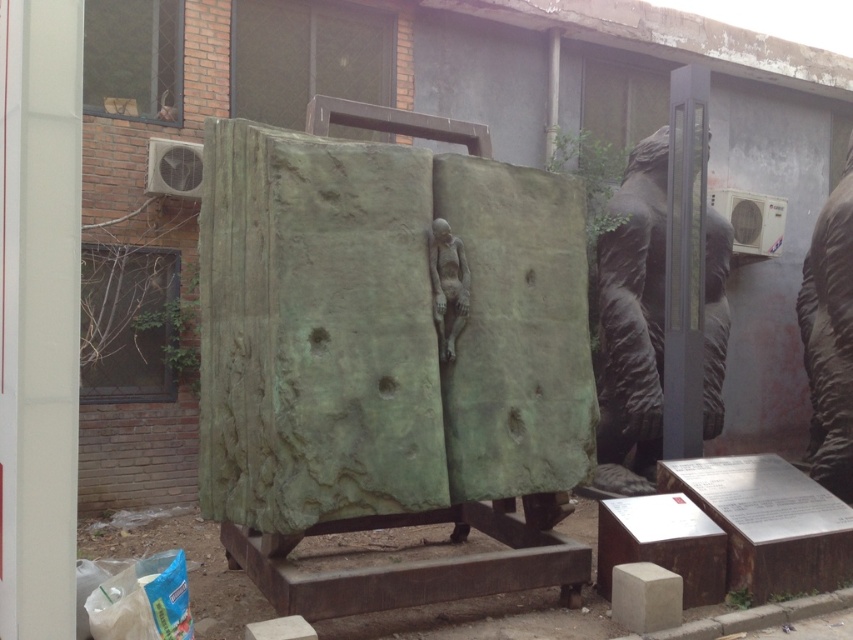
Can you confirm if bronze statue at right is smaller than bronze statue at center?

No.

This screenshot has width=853, height=640. What do you see at coordinates (633, 312) in the screenshot?
I see `bronze statue at right` at bounding box center [633, 312].

Is point (654, 390) closer to camera compared to point (461, 326)?

No, it is behind (461, 326).

The height and width of the screenshot is (640, 853). I want to click on bronze statue at right, so click(x=633, y=312).

Does bronze statue at right appear over green stone statue at right?

Yes, bronze statue at right is above green stone statue at right.

Between point (633, 426) and point (833, 240), which one is positioned behind?

The point (633, 426) is more distant.

This screenshot has width=853, height=640. I want to click on bronze statue at right, so click(633, 312).

Does green stone statue at right have a smaller size compared to bronze statue at center?

No, green stone statue at right is not smaller than bronze statue at center.

Where is `green stone statue at right`? The height and width of the screenshot is (640, 853). green stone statue at right is located at coordinates (828, 339).

Who is more distant from viewer, [833,433] or [456,324]?

The point [833,433] is more distant.

I want to click on green stone statue at right, so click(828, 339).